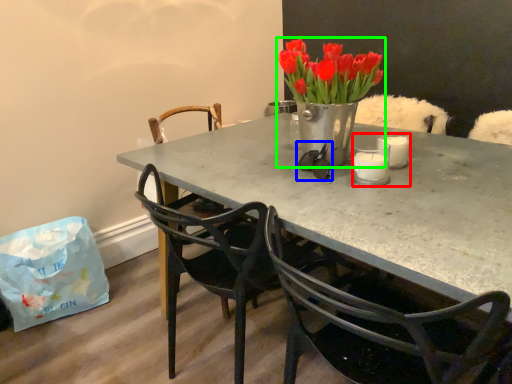
Question: Which object is positioned closest to candle holder (highlighted by a red box)? Select from glasses (highlighted by a blue box) and houseplant (highlighted by a green box).

Choices:
 (A) glasses
 (B) houseplant

Answer: (A)